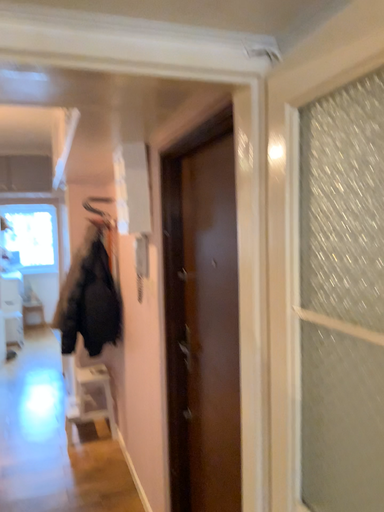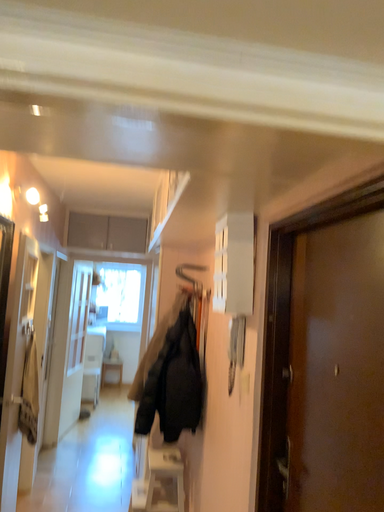
Question: How did the camera likely rotate when shooting the video?

Choices:
 (A) rotated left
 (B) rotated right

Answer: (A)